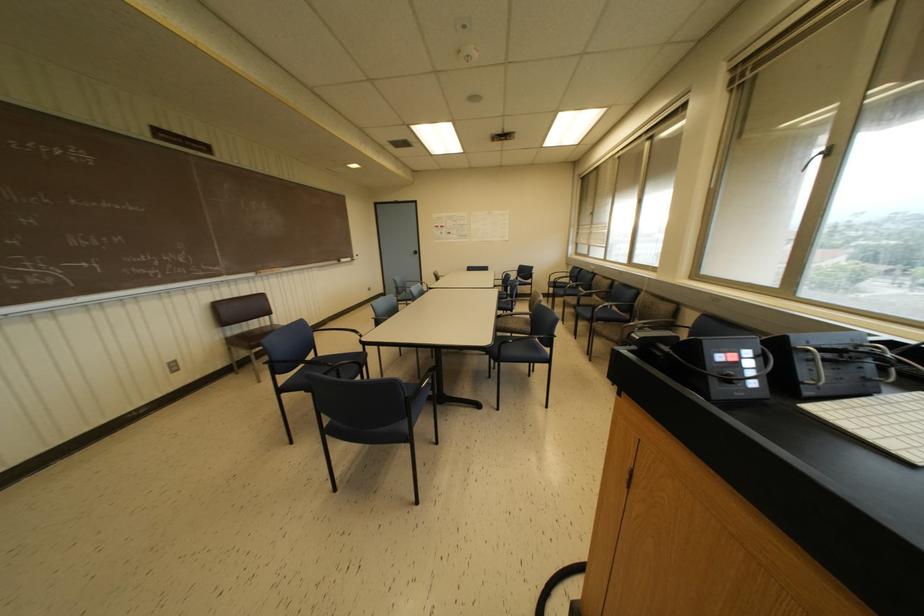
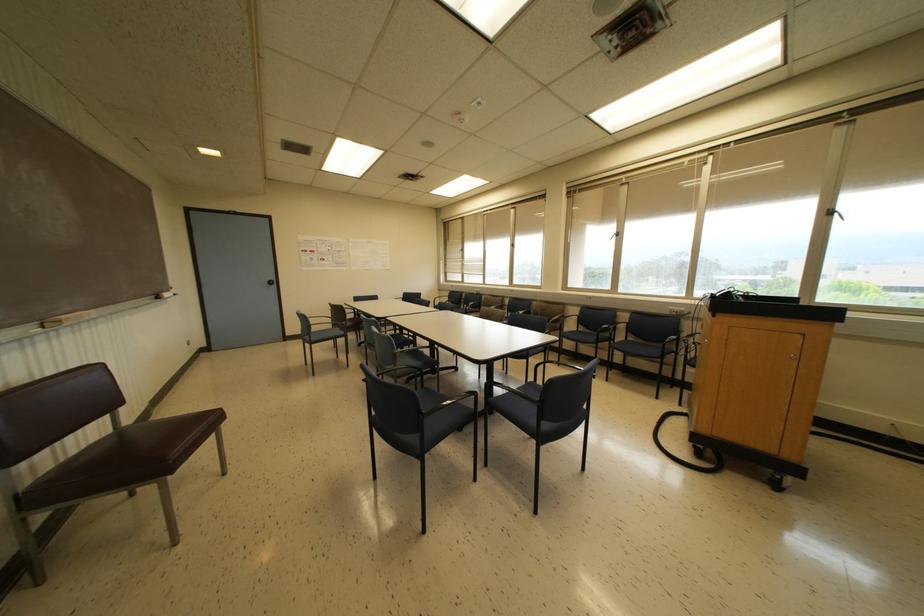
The point at [417,252] is marked in the first image. Where is the corresponding point in the second image?

(274, 282)